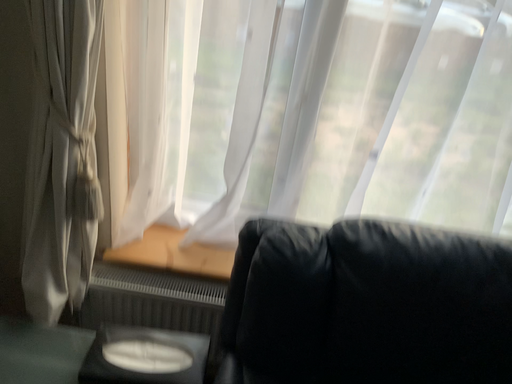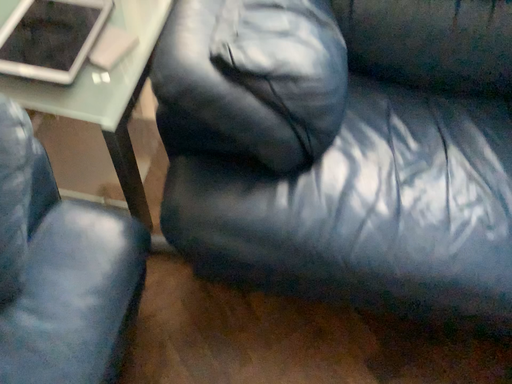
Question: Which way did the camera rotate in the video?

Choices:
 (A) rotated downward
 (B) rotated upward

Answer: (A)